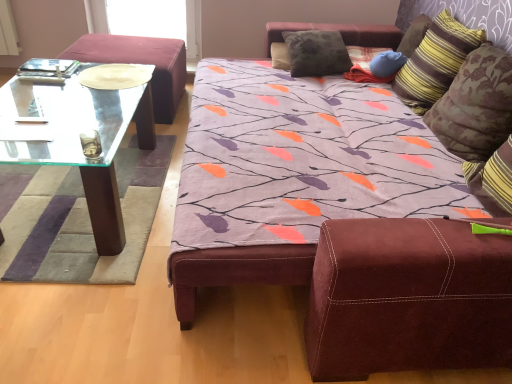
Question: In terms of height, does striped fabric pillow at upper right, the 1th pillow positioned from the right, look taller or shorter compared to transparent glass coffee table at left?

Choices:
 (A) short
 (B) tall

Answer: (B)

Question: Considering the relative positions of striped fabric pillow at upper right, the 1th pillow positioned from the right, and transparent glass coffee table at left in the image provided, is striped fabric pillow at upper right, the 1th pillow positioned from the right, to the left or to the right of transparent glass coffee table at left?

Choices:
 (A) right
 (B) left

Answer: (A)

Question: Estimate the real-world distances between objects in this image. Which object is closer to the striped fabric pillow at upper right, which is the 3th pillow from left to right?

Choices:
 (A) striped fabric pillow at upper right, placed as the fourth pillow when sorted from left to right
 (B) velvet burgundy ottoman at left
 (C) blue fabric pillow at upper right, which is counted as the second pillow, starting from the left
 (D) transparent glass coffee table at left
 (E) velvety gray pillow at upper center, positioned as the 4th pillow in right-to-left order

Answer: (C)

Question: Estimate the real-world distances between objects in this image. Which object is closer to the striped fabric pillow at upper right, placed as the fourth pillow when sorted from left to right?

Choices:
 (A) velvet burgundy ottoman at left
 (B) transparent glass coffee table at left
 (C) striped fabric pillow at upper right, marked as the second pillow in a right-to-left arrangement
 (D) blue fabric pillow at upper right, which is counted as the second pillow, starting from the left
 (E) velvety gray pillow at upper center, positioned as the 4th pillow in right-to-left order

Answer: (C)